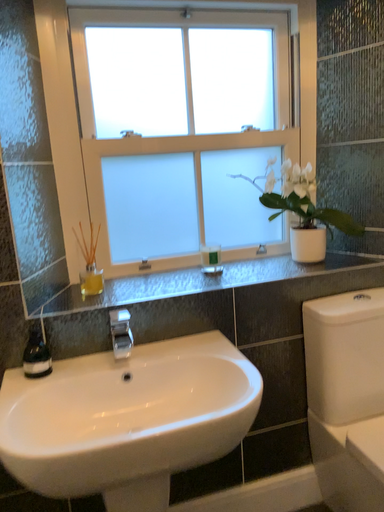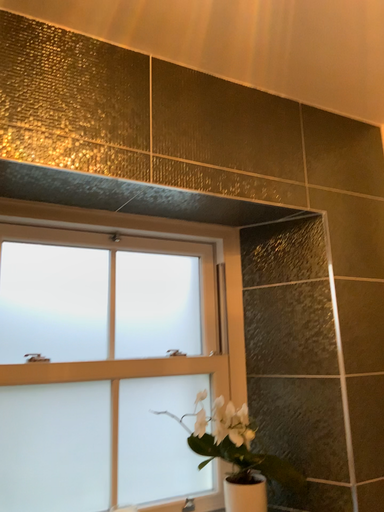
Question: How did the camera likely rotate when shooting the video?

Choices:
 (A) rotated right
 (B) rotated left

Answer: (A)